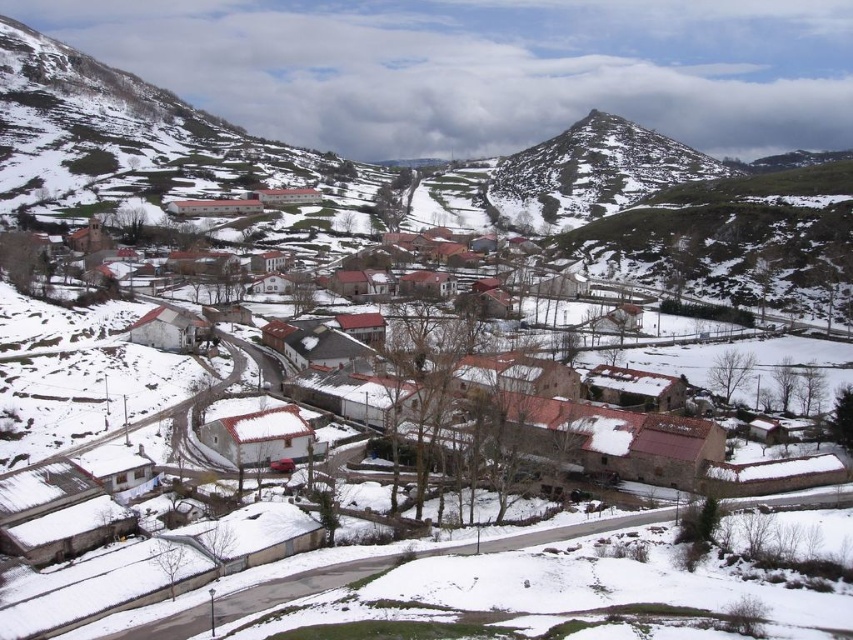
Is white stone houses at center in front of green grassy peak at upper right?

Yes, it is.

What do you see at coordinates (645, 448) in the screenshot?
I see `white stone houses at center` at bounding box center [645, 448].

Describe the element at coordinates (645, 448) in the screenshot. I see `white stone houses at center` at that location.

At what (x,y) coordinates should I click in order to perform the action: click on white stone houses at center. Please return your answer as a coordinate pair (x, y). Looking at the image, I should click on (645, 448).